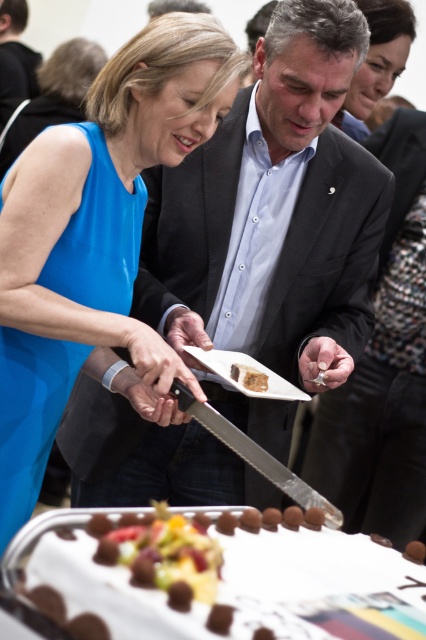
Can you confirm if white cream cake with chocolate truffles at center is positioned above brown crumbly cake at center?

No.

This screenshot has height=640, width=426. In order to click on white cream cake with chocolate truffles at center in this screenshot , I will do `click(317, 584)`.

You are a GUI agent. You are given a task and a screenshot of the screen. Output one action in this format:
    pyautogui.click(x=<x>, y=<y>)
    Task: Click on the white cream cake with chocolate truffles at center
    
    Given the screenshot: What is the action you would take?
    pyautogui.click(x=317, y=584)

Image resolution: width=426 pixels, height=640 pixels. I want to click on white chocolate truffle at lower center, so click(x=161, y=548).

Who is positioned more to the right, white chocolate truffle at lower center or matte black dress at upper center?

Positioned to the right is matte black dress at upper center.

Is point (132, 516) positioned after point (367, 109)?

No.

Locate an element on the screen. This screenshot has height=640, width=426. white chocolate truffle at lower center is located at coordinates (161, 548).

Who is taller, blue silk dress at upper left or brown crumbly cake at center?

With more height is blue silk dress at upper left.

Can you confirm if blue silk dress at upper left is bigger than brown crumbly cake at center?

Yes, blue silk dress at upper left is bigger than brown crumbly cake at center.

The image size is (426, 640). What are the coordinates of `blue silk dress at upper left` in the screenshot? It's located at (95, 240).